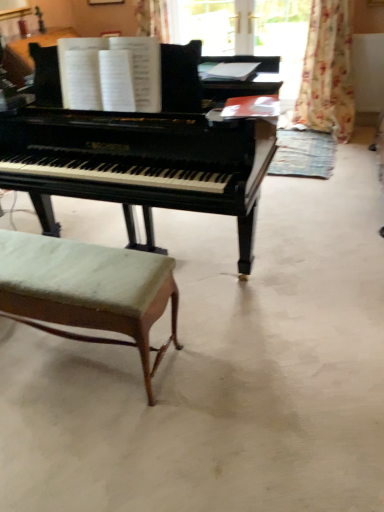
You are a GUI agent. You are given a task and a screenshot of the screen. Output one action in this format:
    pyautogui.click(x=<x>, y=<y>)
    Task: Click on the vacant space to the right of green fabric stool at lower left
    Image resolution: width=384 pixels, height=512 pixels.
    Given the screenshot: What is the action you would take?
    click(225, 357)